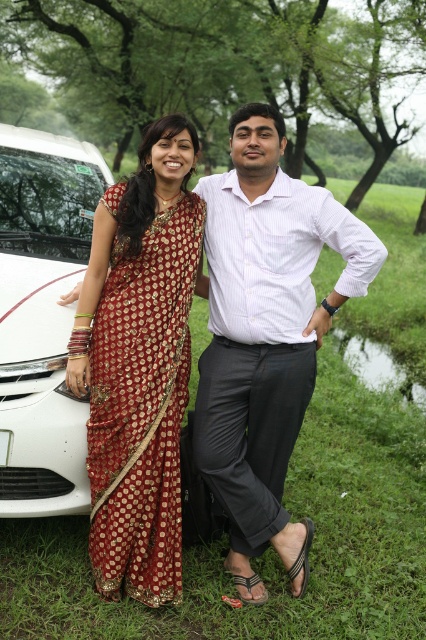
Does red silk saree at left have a smaller size compared to white glossy car at left?

Yes, red silk saree at left is smaller than white glossy car at left.

Measure the distance between point (92,496) and camera.

Point (92,496) and camera are 3.13 meters apart.

Is point (114, 433) positioned after point (40, 234)?

No, (114, 433) is closer to viewer.

Where is `red silk saree at left`? This screenshot has height=640, width=426. red silk saree at left is located at coordinates (141, 406).

Describe the element at coordinates (265, 336) in the screenshot. I see `white striped shirt at center` at that location.

Does white striped shirt at center appear on the left side of red silk saree at left?

No, white striped shirt at center is not to the left of red silk saree at left.

What are the coordinates of `white striped shirt at center` in the screenshot? It's located at (265, 336).

Is white striped shirt at center wider than white glossy car at left?

Incorrect, white striped shirt at center's width does not surpass white glossy car at left's.

Between white striped shirt at center and white glossy car at left, which one appears on the left side from the viewer's perspective?

white glossy car at left is more to the left.

Who is more distant from viewer, (x=255, y=227) or (x=60, y=340)?

Positioned behind is point (x=60, y=340).

At what (x,y) coordinates should I click in order to perform the action: click on white striped shirt at center. Please return your answer as a coordinate pair (x, y). The height and width of the screenshot is (640, 426). Looking at the image, I should click on (265, 336).